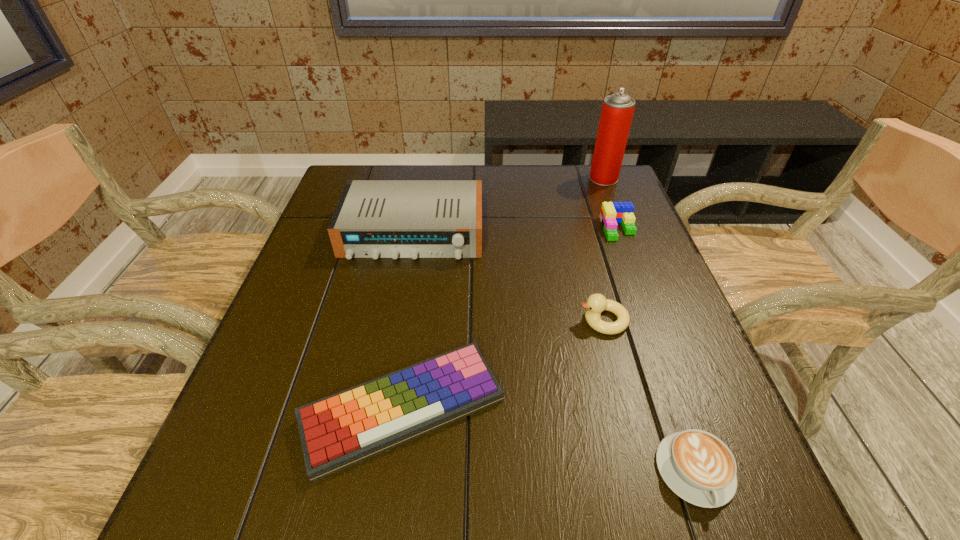
At what (x,y) coordinates should I click in order to perform the action: click on unoccupied area between the computer keyboard and the cappuccino. Please return your answer as a coordinate pair (x, y). Image resolution: width=960 pixels, height=540 pixels. Looking at the image, I should click on (549, 440).

Image resolution: width=960 pixels, height=540 pixels. Identify the location of object that ranks as the fifth closest to the computer keyboard. (617, 111).

At what (x,y) coordinates should I click in order to perform the action: click on the fifth closest object to the Lego. Please return your answer as a coordinate pair (x, y). This screenshot has width=960, height=540. Looking at the image, I should click on (697, 466).

Locate an element on the screen. The image size is (960, 540). vacant area that satisfies the following two spatial constraints: 1. on the back side of the computer keyboard; 2. on the right side of the Lego is located at coordinates (429, 228).